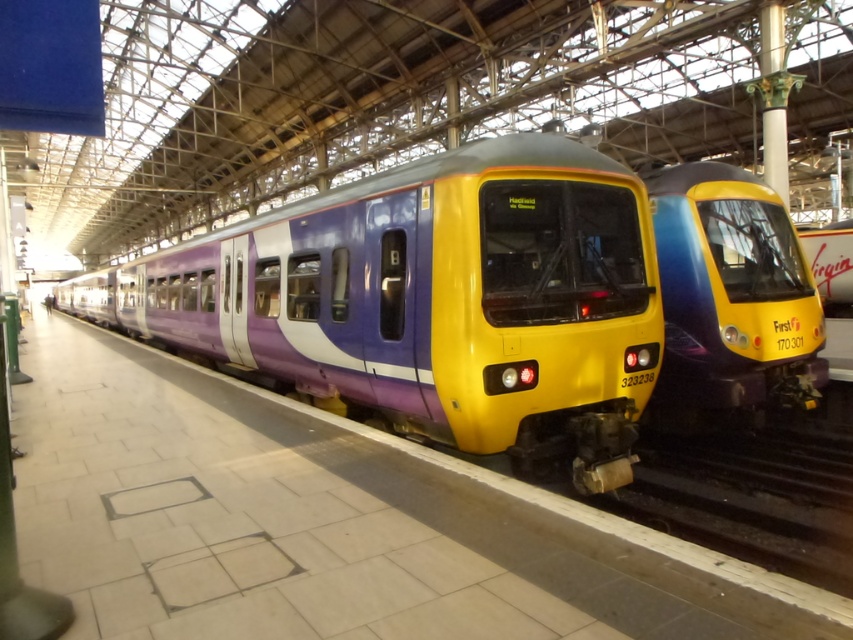
Question: Which of the following is the closest to the observer?

Choices:
 (A) purple glossy train at center
 (B) yellow glossy train at center

Answer: (A)

Question: Is purple glossy train at center above yellow glossy train at center?

Choices:
 (A) no
 (B) yes

Answer: (A)

Question: Is purple glossy train at center smaller than yellow glossy train at center?

Choices:
 (A) no
 (B) yes

Answer: (A)

Question: Among these objects, which one is nearest to the camera?

Choices:
 (A) purple glossy train at center
 (B) yellow glossy train at center

Answer: (A)

Question: Does purple glossy train at center appear on the right side of yellow glossy train at center?

Choices:
 (A) no
 (B) yes

Answer: (A)